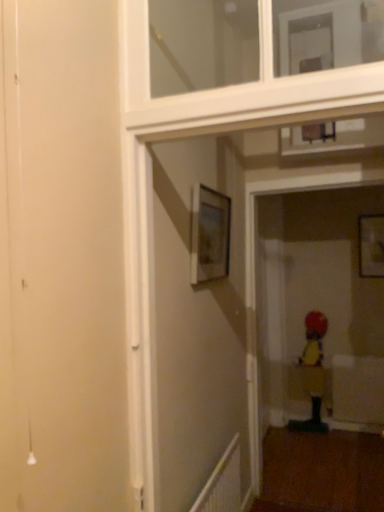
Question: From the image's perspective, is white plastic radiator at lower right located beneath white glossy window frame at upper center?

Choices:
 (A) yes
 (B) no

Answer: (A)

Question: Can you confirm if white plastic radiator at lower right is positioned to the left of white glossy window frame at upper center?

Choices:
 (A) no
 (B) yes

Answer: (B)

Question: Considering the relative sizes of white plastic radiator at lower right and white glossy window frame at upper center in the image provided, is white plastic radiator at lower right wider than white glossy window frame at upper center?

Choices:
 (A) yes
 (B) no

Answer: (B)

Question: Is white plastic radiator at lower right not inside white glossy window frame at upper center?

Choices:
 (A) yes
 (B) no

Answer: (A)

Question: Considering the relative positions of white plastic radiator at lower right and white glossy window frame at upper center in the image provided, is white plastic radiator at lower right to the right of white glossy window frame at upper center from the viewer's perspective?

Choices:
 (A) yes
 (B) no

Answer: (B)

Question: Considering the positions of matte wooden picture frame at upper right, which is the 2th picture frame from front to back, and yellow fabric child at lower right in the image, is matte wooden picture frame at upper right, which is the 2th picture frame from front to back, wider or thinner than yellow fabric child at lower right?

Choices:
 (A) thin
 (B) wide

Answer: (A)

Question: Is matte wooden picture frame at upper right, which is the 2th picture frame from front to back, to the left or to the right of yellow fabric child at lower right in the image?

Choices:
 (A) left
 (B) right

Answer: (B)

Question: Considering their positions, is matte wooden picture frame at upper right, the 2th picture frame in the left-to-right sequence, located in front of or behind yellow fabric child at lower right?

Choices:
 (A) front
 (B) behind

Answer: (A)

Question: From the image's perspective, is matte wooden picture frame at upper right, placed as the 1th picture frame when sorted from right to left, positioned above or below yellow fabric child at lower right?

Choices:
 (A) below
 (B) above

Answer: (B)

Question: In terms of width, does white glossy window frame at upper center look wider or thinner when compared to white plastic radiator at lower right?

Choices:
 (A) wide
 (B) thin

Answer: (A)

Question: In the image, is white glossy window frame at upper center positioned in front of or behind white plastic radiator at lower right?

Choices:
 (A) behind
 (B) front

Answer: (B)

Question: From their relative heights in the image, would you say white glossy window frame at upper center is taller or shorter than white plastic radiator at lower right?

Choices:
 (A) tall
 (B) short

Answer: (B)

Question: Do you think white glossy window frame at upper center is within white plastic radiator at lower right, or outside of it?

Choices:
 (A) inside
 (B) outside

Answer: (B)

Question: From the image's perspective, is matte wooden picture frame at upper right, placed as the 1th picture frame when sorted from right to left, located above or below white glossy window frame at upper center?

Choices:
 (A) below
 (B) above

Answer: (A)

Question: Is point (372, 228) positioned closer to the camera than point (223, 96)?

Choices:
 (A) farther
 (B) closer

Answer: (A)